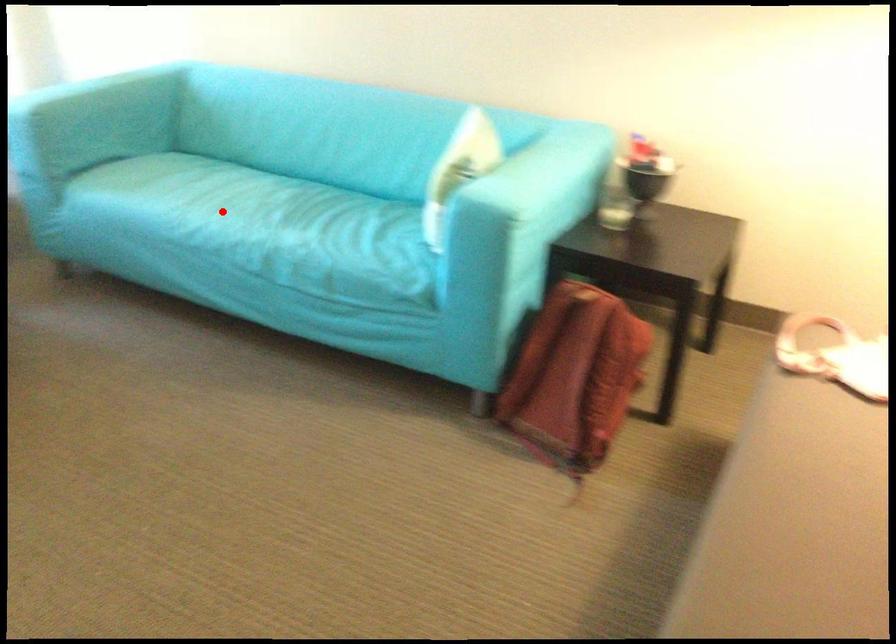
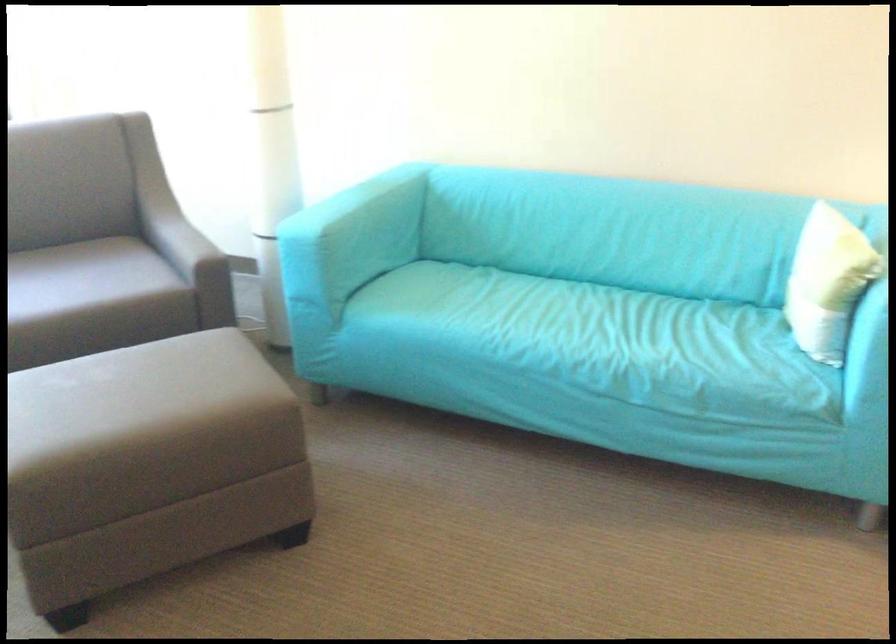
Where in the second image is the point corresponding to the highlighted location from the first image?

(556, 328)